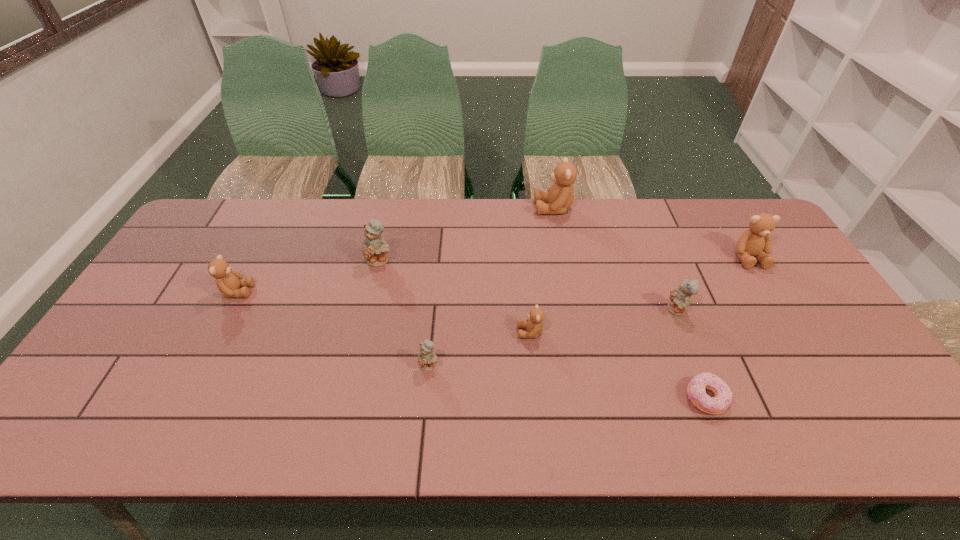
The width and height of the screenshot is (960, 540). Find the location of `object that ranks as the fifth closest to the biggest blue teddy bear`. object that ranks as the fifth closest to the biggest blue teddy bear is located at coordinates (680, 298).

Locate an element on the screen. teddy bear that stands as the fifth closest to the third farthest brown teddy bear is located at coordinates (680, 298).

The width and height of the screenshot is (960, 540). In order to click on teddy bear that stands as the sixth closest to the second teddy bear from right to left in this screenshot , I will do `click(228, 281)`.

Select which brown teddy bear appears as the third closest to the smallest blue teddy bear. Please provide its 2D coordinates. Your answer should be formatted as a tuple, i.e. [(x, y)], where the tuple contains the x and y coordinates of a point satisfying the conditions above.

[(560, 196)]

Locate which brown teddy bear is the second closest to the rightmost blue teddy bear. Please provide its 2D coordinates. Your answer should be formatted as a tuple, i.e. [(x, y)], where the tuple contains the x and y coordinates of a point satisfying the conditions above.

[(534, 325)]

Identify which blue teddy bear is the third nearest to the sixth farthest teddy bear. Please provide its 2D coordinates. Your answer should be formatted as a tuple, i.e. [(x, y)], where the tuple contains the x and y coordinates of a point satisfying the conditions above.

[(375, 248)]

At what (x,y) coordinates should I click in order to perform the action: click on blue teddy bear that is the closest to the leftmost object. Please return your answer as a coordinate pair (x, y). The width and height of the screenshot is (960, 540). Looking at the image, I should click on (375, 248).

You are a GUI agent. You are given a task and a screenshot of the screen. Output one action in this format:
    pyautogui.click(x=<x>, y=<y>)
    Task: Click on the free location that satisfies the following two spatial constraints: 1. on the front-facing side of the second object from left to right; 2. on the face of the leftmost teddy bear
    The width and height of the screenshot is (960, 540).
    Given the screenshot: What is the action you would take?
    372,291

At what (x,y) coordinates should I click in order to perform the action: click on vacant space that satisfies the following two spatial constraints: 1. on the face of the tallest teddy bear; 2. on the front-facing side of the biggest blue teddy bear. Please return your answer as a coordinate pair (x, y). Looking at the image, I should click on (564, 260).

I want to click on free location that satisfies the following two spatial constraints: 1. on the front-facing side of the second teddy bear from left to right; 2. on the face of the leftmost brown teddy bear, so [372, 291].